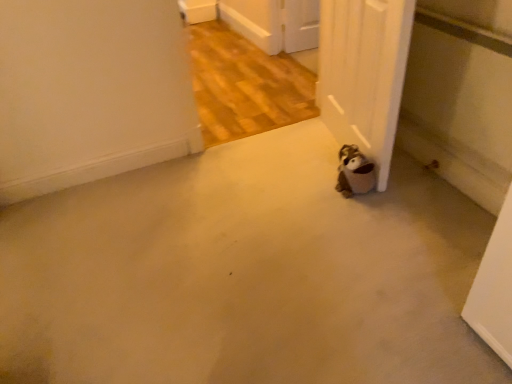
Question: From a real-world perspective, is beige carpet at lower center on white matte door at lower right?

Choices:
 (A) yes
 (B) no

Answer: (B)

Question: Considering the relative sizes of beige carpet at lower center and white matte door at lower right in the image provided, is beige carpet at lower center taller than white matte door at lower right?

Choices:
 (A) no
 (B) yes

Answer: (A)

Question: Can you confirm if beige carpet at lower center is thinner than white matte door at lower right?

Choices:
 (A) no
 (B) yes

Answer: (A)

Question: Is beige carpet at lower center smaller than white matte door at lower right?

Choices:
 (A) no
 (B) yes

Answer: (A)

Question: Would you say beige carpet at lower center is a long distance from white matte door at lower right?

Choices:
 (A) no
 (B) yes

Answer: (A)

Question: Can you confirm if beige carpet at lower center is shorter than white matte door at lower right?

Choices:
 (A) yes
 (B) no

Answer: (A)

Question: Considering the relative positions of white matte door at lower right and beige carpet at lower center in the image provided, is white matte door at lower right to the right of beige carpet at lower center from the viewer's perspective?

Choices:
 (A) no
 (B) yes

Answer: (B)

Question: Are white matte door at lower right and beige carpet at lower center far apart?

Choices:
 (A) yes
 (B) no

Answer: (B)

Question: From a real-world perspective, is white matte door at lower right under beige carpet at lower center?

Choices:
 (A) no
 (B) yes

Answer: (A)

Question: Is white matte door at lower right aimed at beige carpet at lower center?

Choices:
 (A) no
 (B) yes

Answer: (B)

Question: Would you say beige carpet at lower center is part of white matte door at lower right's contents?

Choices:
 (A) no
 (B) yes

Answer: (A)

Question: Is white matte door at lower right smaller than beige carpet at lower center?

Choices:
 (A) no
 (B) yes

Answer: (B)

Question: Can you confirm if brown plush toy at lower right is thinner than white matte door at lower right?

Choices:
 (A) no
 (B) yes

Answer: (A)